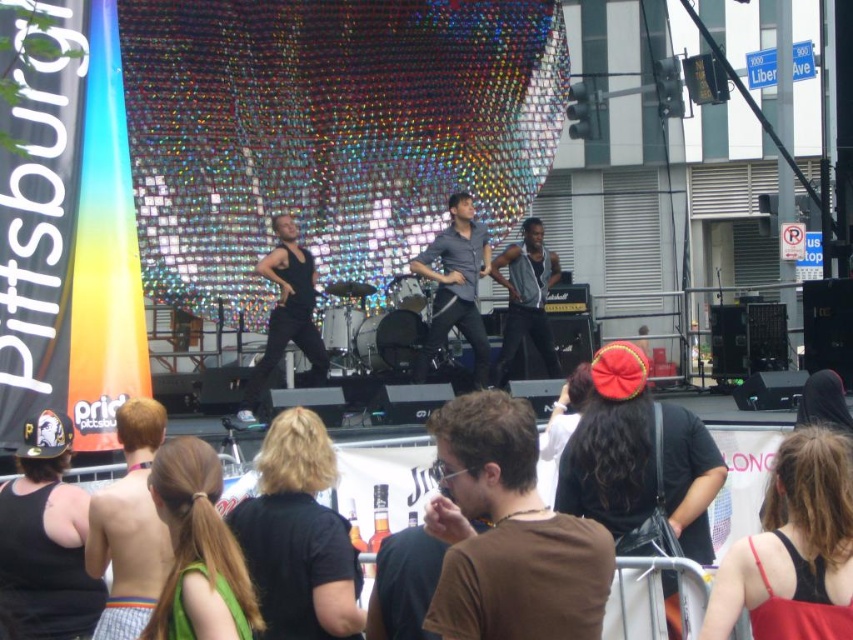
You are a photographer at the concert and want to capture the skinny jeans at lower left in your shot. What are the exact coordinates where you should focus your camera?

The skinny jeans at lower left are located at coordinates point (x=129, y=525).

You are a photographer at the concert and want to take a photo of the matte gray shirt at center. Where should you aim your camera to capture it?

You should aim your camera at the coordinates point [456,285] to capture the matte gray shirt at center.